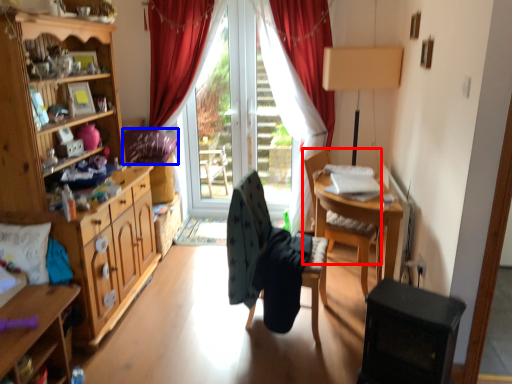
Question: Which point is closer to the camera, chair (highlighted by a red box) or pillow (highlighted by a blue box)?

Choices:
 (A) chair
 (B) pillow

Answer: (A)